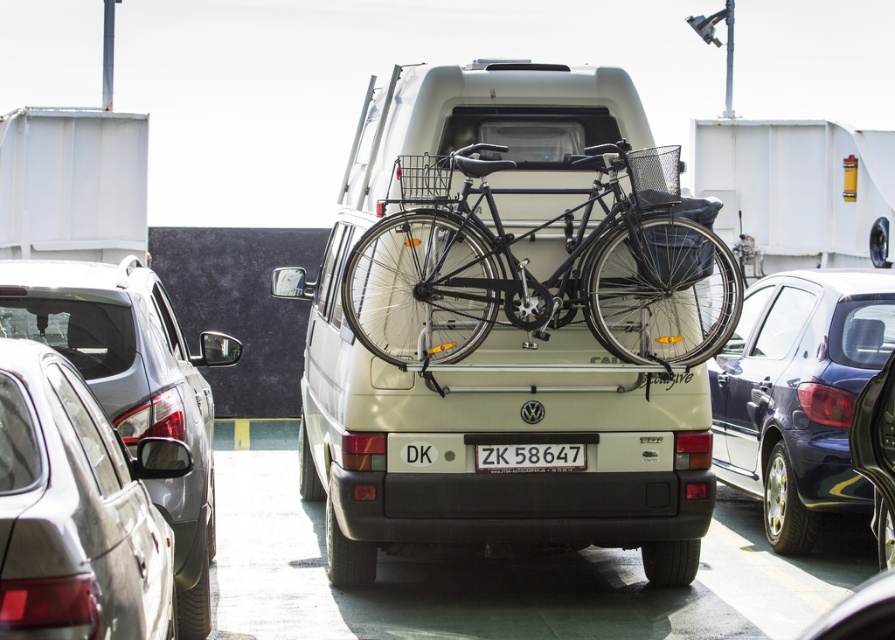
You are planning to park your car in a tight space and need to know which vehicle takes up less space. Based on the scene, which car between the satin silver car at left and the metallic blue sedan at right is smaller?

The satin silver car at left is smaller in size compared to the metallic blue sedan at right, so it would take up less space.

You are standing at the ferry terminal and want to take a photo of the two points marked on the Volkswagen camper van. Which point, point 1 at coordinates (x=160, y=564) or point 2 at coordinates (x=867, y=312), will appear larger in your photo?

Point 1 at coordinates (x=160, y=564) will appear larger in the photo because it is closer to the camera than point 2 at coordinates (x=867, y=312).

You are a passenger in the satin silver car at left and want to park your car so that it is directly in front of the shiny black bicycle at center. Based on the current positions, which direction should you move your car to align it with the bicycle?

The shiny black bicycle at center is to the right of the satin silver car at left, so you should move your car to the right to align it with the bicycle.